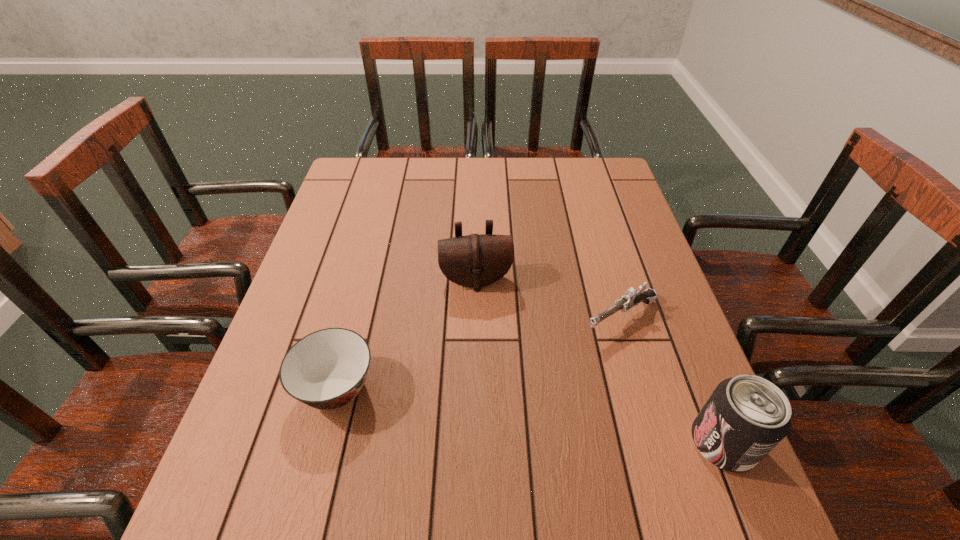
Locate an element on the screen. empty space between the gun and the soda can is located at coordinates (672, 381).

What are the coordinates of `free point between the gun and the leftmost object` in the screenshot? It's located at (479, 353).

Locate an element on the screen. The width and height of the screenshot is (960, 540). empty space that is in between the soup bowl and the pouch is located at coordinates 406,334.

Identify the location of free area in between the soup bowl and the soda can. The height and width of the screenshot is (540, 960). (529, 416).

Find the location of a particular element. The height and width of the screenshot is (540, 960). vacant point located between the third nearest object and the second object from left to right is located at coordinates (548, 299).

What are the coordinates of `unoccupied position between the third nearest object and the pouch` in the screenshot? It's located at (548, 299).

Where is `vacant area that lies between the third nearest object and the soda can`? vacant area that lies between the third nearest object and the soda can is located at coordinates (672, 381).

The height and width of the screenshot is (540, 960). What are the coordinates of `object that ranks as the third closest to the second farthest object` in the screenshot? It's located at tap(327, 369).

You are a GUI agent. You are given a task and a screenshot of the screen. Output one action in this format:
    pyautogui.click(x=<x>, y=<y>)
    Task: Click on the closest object to the third object from right to left
    
    Given the screenshot: What is the action you would take?
    coord(632,297)

Identify the location of free space that satisfies the following two spatial constraints: 1. on the front side of the third nearest object; 2. on the left side of the third object from right to left. This screenshot has width=960, height=540. (475, 318).